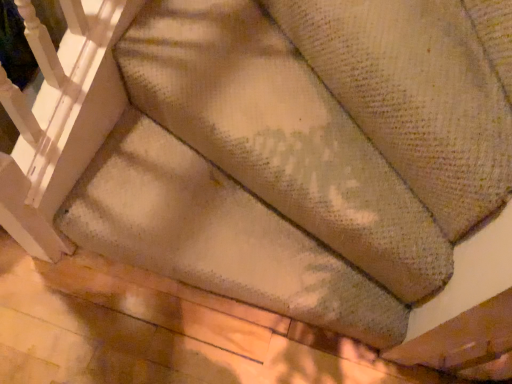
I want to click on textured beige carpet at center, so click(x=217, y=235).

What do you see at coordinates (217, 235) in the screenshot? I see `textured beige carpet at center` at bounding box center [217, 235].

Locate an element on the screen. The width and height of the screenshot is (512, 384). textured beige carpet at center is located at coordinates click(217, 235).